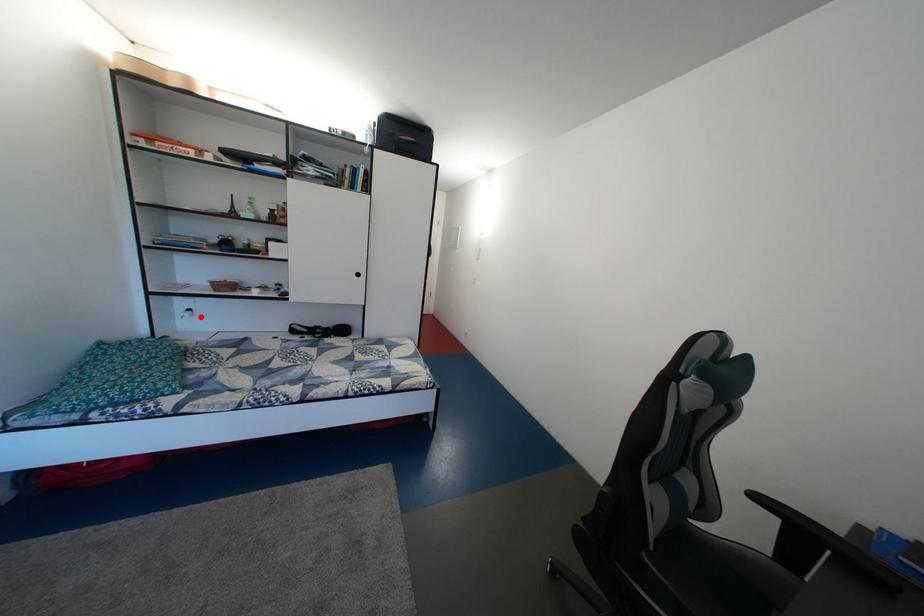
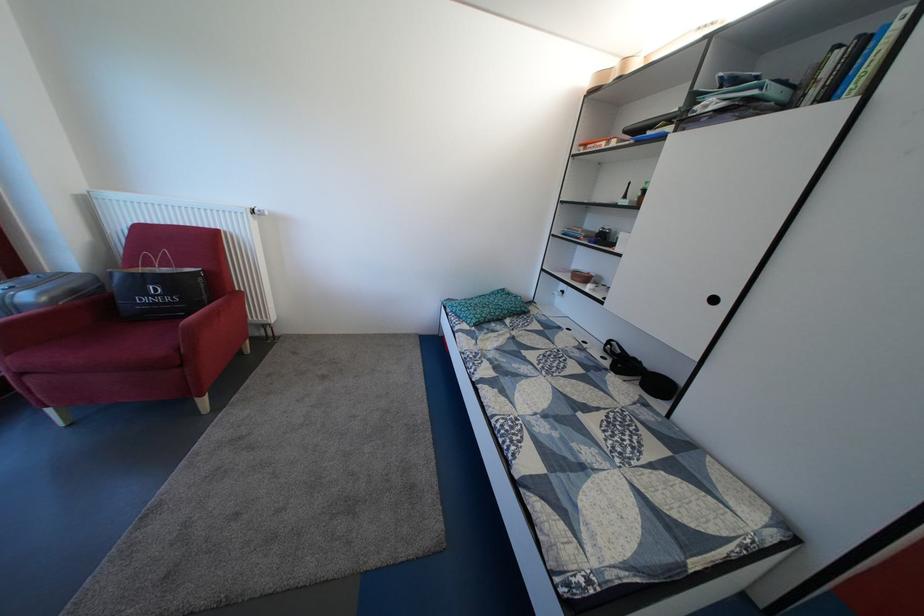
In the second image, find the point that corresponds to the highlighted location in the first image.

(574, 299)